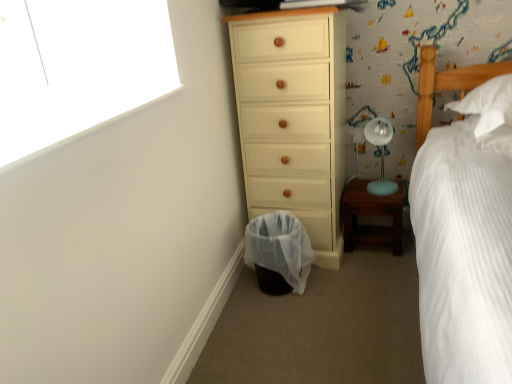
Locate an element on the screen. The width and height of the screenshot is (512, 384). vacant area that is in front of matte cream chest of drawers at center is located at coordinates (330, 292).